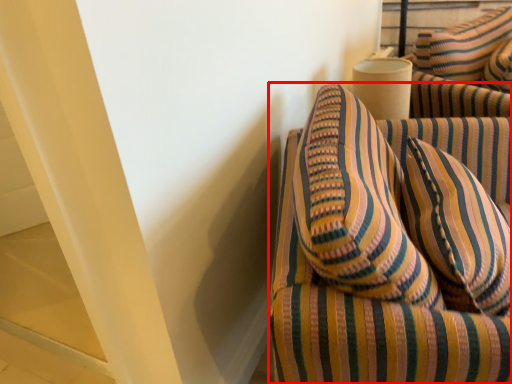
Question: In this image, where is furniture (annotated by the red box) located relative to pillow?

Choices:
 (A) left
 (B) right

Answer: (A)